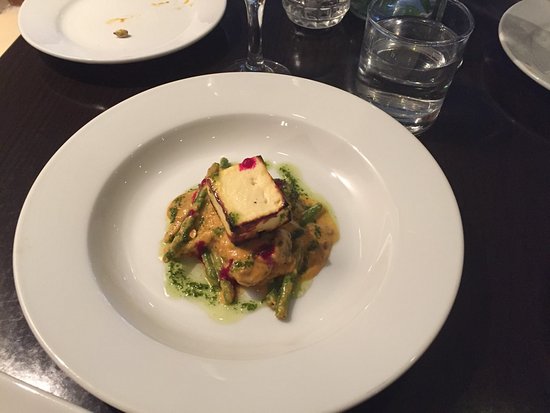
This screenshot has height=413, width=550. I want to click on plate, so click(x=182, y=378).